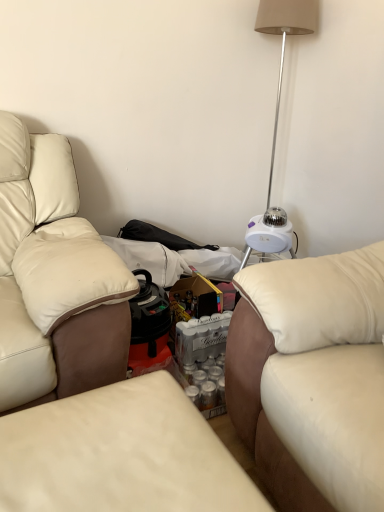
Question: Considering the relative sizes of leather couch at center, marked as the second studio couch in a right-to-left arrangement, and white leather studio couch at right, the second studio couch viewed from the left, in the image provided, is leather couch at center, marked as the second studio couch in a right-to-left arrangement, smaller than white leather studio couch at right, the second studio couch viewed from the left,?

Choices:
 (A) no
 (B) yes

Answer: (B)

Question: From a real-world perspective, is leather couch at center, which ranks as the 1th studio couch in left-to-right order, physically below white leather studio couch at right, the first studio couch in the right-to-left sequence?

Choices:
 (A) yes
 (B) no

Answer: (A)

Question: Can you confirm if leather couch at center, marked as the second studio couch in a right-to-left arrangement, is thinner than white leather studio couch at right, the first studio couch in the right-to-left sequence?

Choices:
 (A) yes
 (B) no

Answer: (A)

Question: Does leather couch at center, marked as the second studio couch in a right-to-left arrangement, have a greater height compared to white leather studio couch at right, the second studio couch viewed from the left?

Choices:
 (A) yes
 (B) no

Answer: (B)

Question: Is leather couch at center, marked as the second studio couch in a right-to-left arrangement, wider than white leather studio couch at right, the second studio couch viewed from the left?

Choices:
 (A) yes
 (B) no

Answer: (B)

Question: Is the position of leather couch at center, marked as the second studio couch in a right-to-left arrangement, more distant than that of white leather studio couch at right, the first studio couch in the right-to-left sequence?

Choices:
 (A) no
 (B) yes

Answer: (A)

Question: From a real-world perspective, is white plastic table lamp at upper right beneath leather couch at center, which ranks as the 1th studio couch in left-to-right order?

Choices:
 (A) yes
 (B) no

Answer: (B)

Question: Does white plastic table lamp at upper right have a greater height compared to leather couch at center, marked as the second studio couch in a right-to-left arrangement?

Choices:
 (A) yes
 (B) no

Answer: (A)

Question: Considering the relative sizes of white plastic table lamp at upper right and leather couch at center, marked as the second studio couch in a right-to-left arrangement, in the image provided, is white plastic table lamp at upper right smaller than leather couch at center, marked as the second studio couch in a right-to-left arrangement,?

Choices:
 (A) no
 (B) yes

Answer: (A)

Question: Is white plastic table lamp at upper right to the left of leather couch at center, marked as the second studio couch in a right-to-left arrangement, from the viewer's perspective?

Choices:
 (A) no
 (B) yes

Answer: (A)

Question: Can you confirm if white plastic table lamp at upper right is thinner than leather couch at center, which ranks as the 1th studio couch in left-to-right order?

Choices:
 (A) no
 (B) yes

Answer: (B)

Question: Is white plastic table lamp at upper right further to camera compared to leather couch at center, which ranks as the 1th studio couch in left-to-right order?

Choices:
 (A) no
 (B) yes

Answer: (B)

Question: Is leather couch at center, marked as the second studio couch in a right-to-left arrangement, thinner than white plastic table lamp at upper right?

Choices:
 (A) yes
 (B) no

Answer: (B)